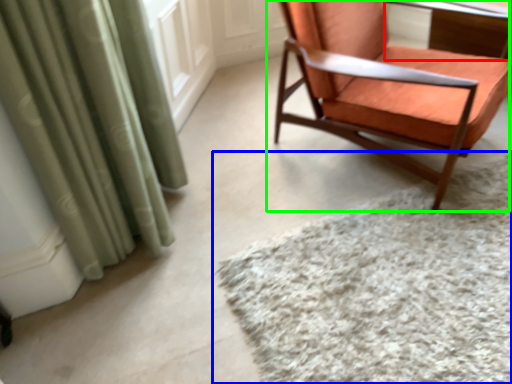
Question: Which object is the closest to the table (highlighted by a red box)? Choose among these: mat (highlighted by a blue box) or chair (highlighted by a green box).

Choices:
 (A) mat
 (B) chair

Answer: (B)